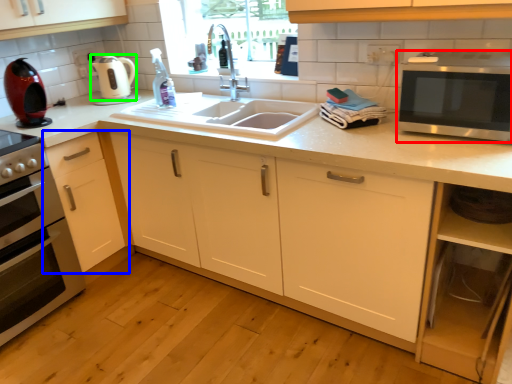
Question: Considering the real-world distances, which object is farthest from microwave oven (highlighted by a red box)? cabinetry (highlighted by a blue box) or appliance (highlighted by a green box)?

Choices:
 (A) cabinetry
 (B) appliance

Answer: (B)